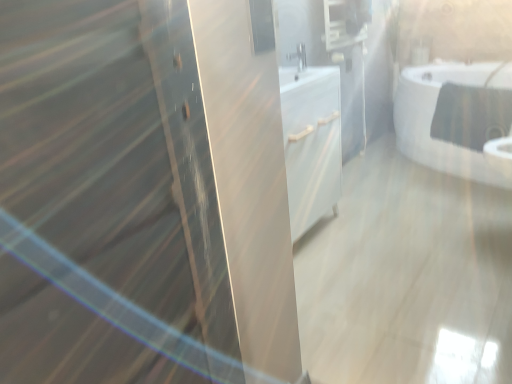
Question: Can you confirm if matte black medicine cabinet at upper center is positioned to the left of white glossy bathtub at upper right?

Choices:
 (A) no
 (B) yes

Answer: (B)

Question: From a real-world perspective, is matte black medicine cabinet at upper center beneath white glossy bathtub at upper right?

Choices:
 (A) yes
 (B) no

Answer: (B)

Question: Does matte black medicine cabinet at upper center have a greater width compared to white glossy bathtub at upper right?

Choices:
 (A) yes
 (B) no

Answer: (B)

Question: Is matte black medicine cabinet at upper center further to the viewer compared to white glossy bathtub at upper right?

Choices:
 (A) yes
 (B) no

Answer: (A)

Question: From the image's perspective, is matte black medicine cabinet at upper center located beneath white glossy bathtub at upper right?

Choices:
 (A) yes
 (B) no

Answer: (B)

Question: Considering the positions of point (292, 56) and point (506, 69), is point (292, 56) closer or farther from the camera than point (506, 69)?

Choices:
 (A) closer
 (B) farther

Answer: (A)

Question: Considering the relative positions of satin nickel faucet at center and white glossy bathtub at upper right in the image provided, is satin nickel faucet at center to the left or to the right of white glossy bathtub at upper right?

Choices:
 (A) left
 (B) right

Answer: (A)

Question: In the image, is satin nickel faucet at center positioned in front of or behind white glossy bathtub at upper right?

Choices:
 (A) front
 (B) behind

Answer: (A)

Question: In terms of size, does satin nickel faucet at center appear bigger or smaller than white glossy bathtub at upper right?

Choices:
 (A) big
 (B) small

Answer: (B)

Question: Choose the correct answer: Is white glossy bathtub at upper right inside matte black medicine cabinet at upper center or outside it?

Choices:
 (A) inside
 (B) outside

Answer: (B)

Question: From the image's perspective, is white glossy bathtub at upper right located above or below matte black medicine cabinet at upper center?

Choices:
 (A) above
 (B) below

Answer: (B)

Question: In the image, is white glossy bathtub at upper right positioned in front of or behind matte black medicine cabinet at upper center?

Choices:
 (A) front
 (B) behind

Answer: (A)

Question: Looking at their shapes, would you say white glossy bathtub at upper right is wider or thinner than matte black medicine cabinet at upper center?

Choices:
 (A) wide
 (B) thin

Answer: (A)

Question: Relative to satin nickel faucet at center, is white glossy bathtub at upper right in front or behind?

Choices:
 (A) behind
 (B) front

Answer: (A)

Question: Is point (496, 102) positioned closer to the camera than point (303, 57)?

Choices:
 (A) closer
 (B) farther

Answer: (A)